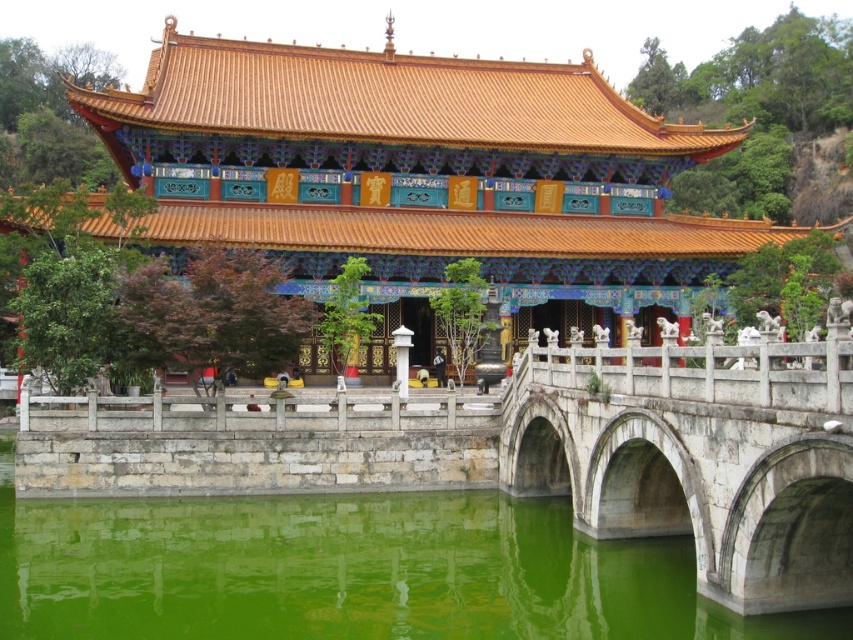
You are a tourist standing in front of the traditional Chinese building. You want to take a photo of the shiny gold roof at center and the white stone bridge at center. Which object should you focus on first if you want to capture both in one frame?

The shiny gold roof at center is above the white stone bridge at center, so you should focus on the white stone bridge at center first to ensure both are in the frame.

You are standing in front of a traditional Chinese building with a stone bridge leading to its entrance. You notice a specific point marked at coordinates (421, 168). What object is located at this point?

The shiny gold roof at center is located at point (421, 168).

In the scene shown: You are standing at the entrance of the temple and want to take a photo of the shiny gold roof at center. According to the coordinates provided, where should you position yourself to capture the roof in the center of your camera frame?

The shiny gold roof at center is located at coordinates point (421, 168), so you should position yourself directly in front of that point to center it in your camera frame.